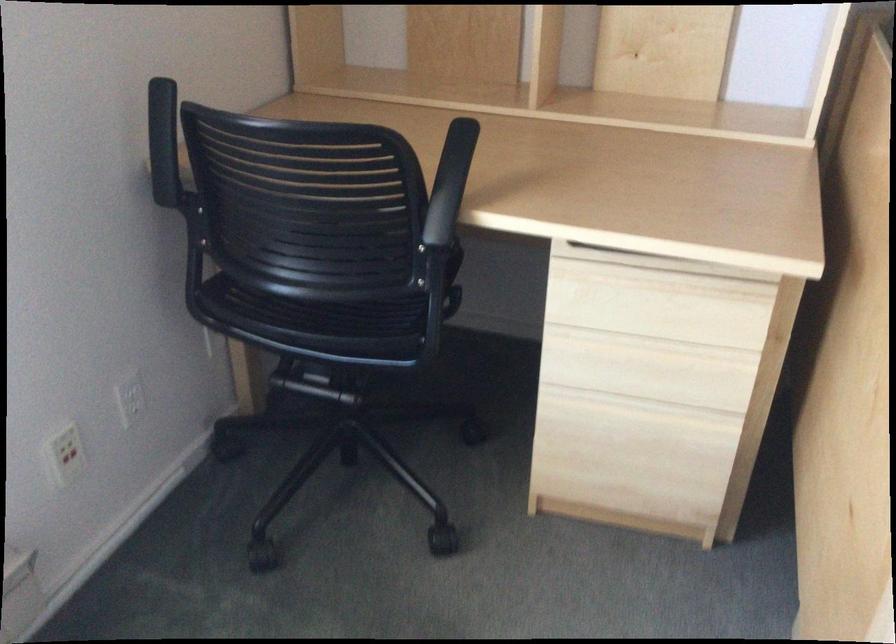
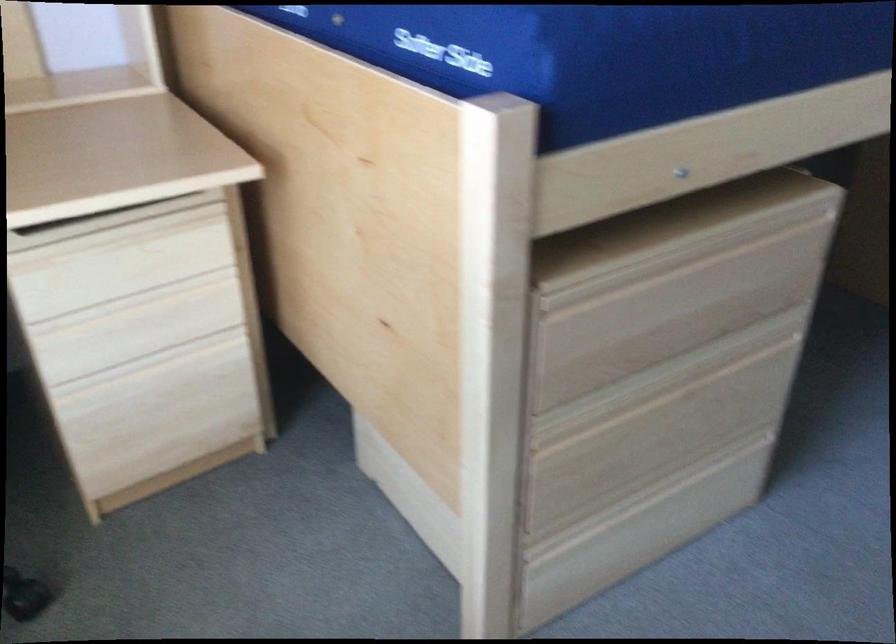
Where in the second image is the point corresponding to the point at 633,404 from the first image?

(152, 361)